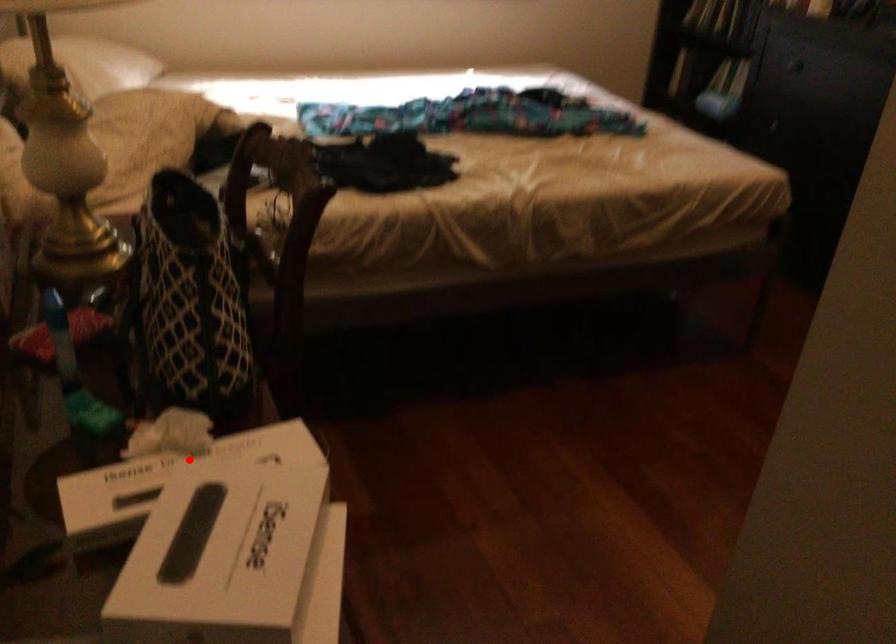
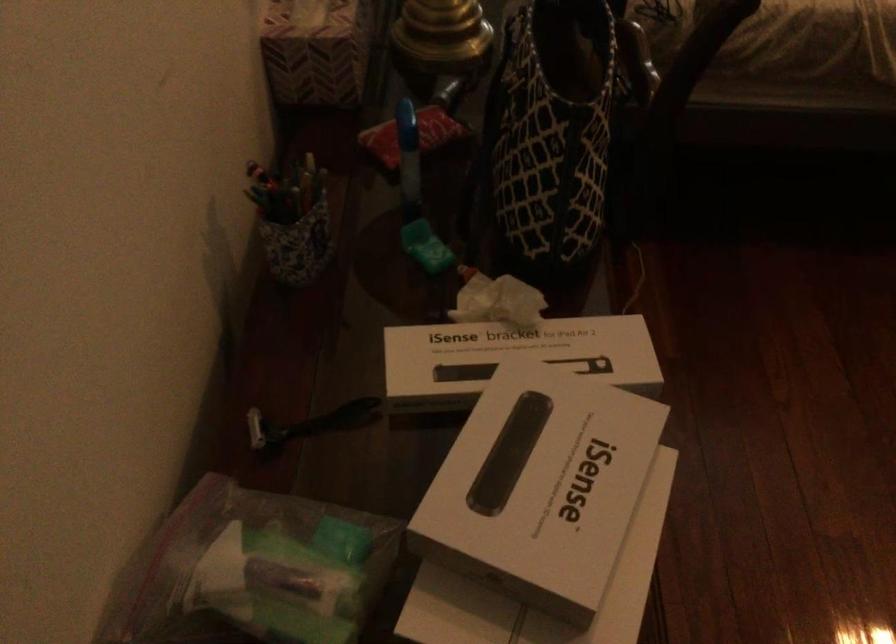
Question: A red point is marked in image1. In image2, is the corresponding 3D point closer to the camera or farther? Reply with the corresponding letter.

Choices:
 (A) The corresponding 3D point is closer.
 (B) The corresponding 3D point is farther.

Answer: (A)